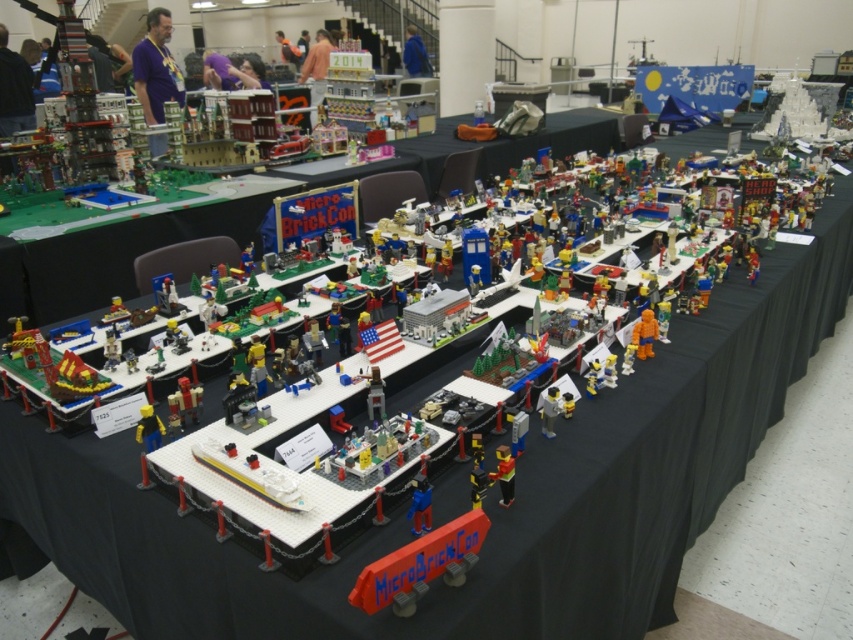
You are at the LEGO event and need to reach the snack bar located at point (x=253, y=339). There is an obstacle at point (x=502, y=460). Can you walk directly to the snack bar without going around the obstacle?

Point (x=502, y=460) is in front of point (x=253, y=339), so the obstacle is blocking the path. You need to go around it to reach the snack bar.

You are a LEGO enthusiast attending Micro BrickCon and notice two figures at the center of the display table. Which figure is bigger between the yellow matte figure at center and the black plastic minifigure at center?

The yellow matte figure at center is larger in size compared to the black plastic minifigure at center.